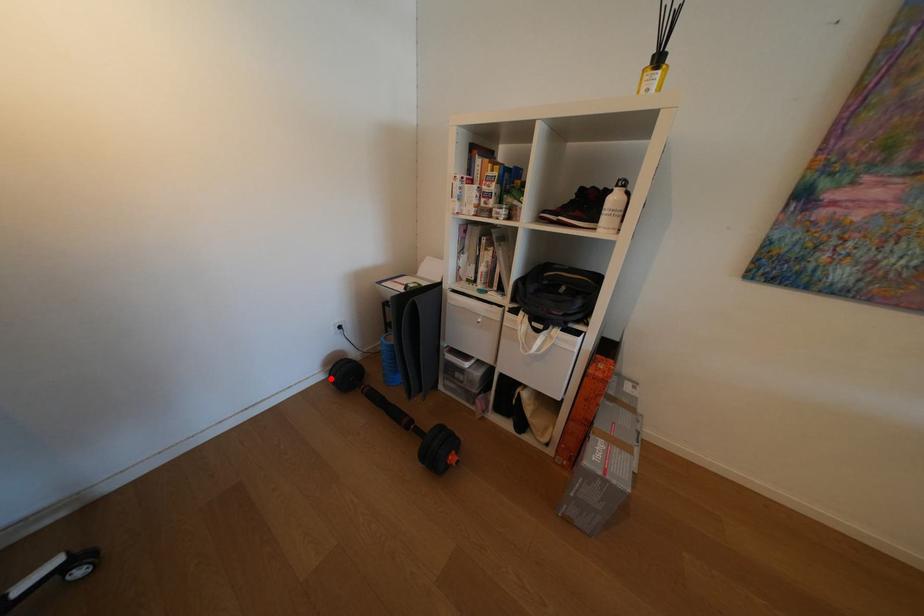
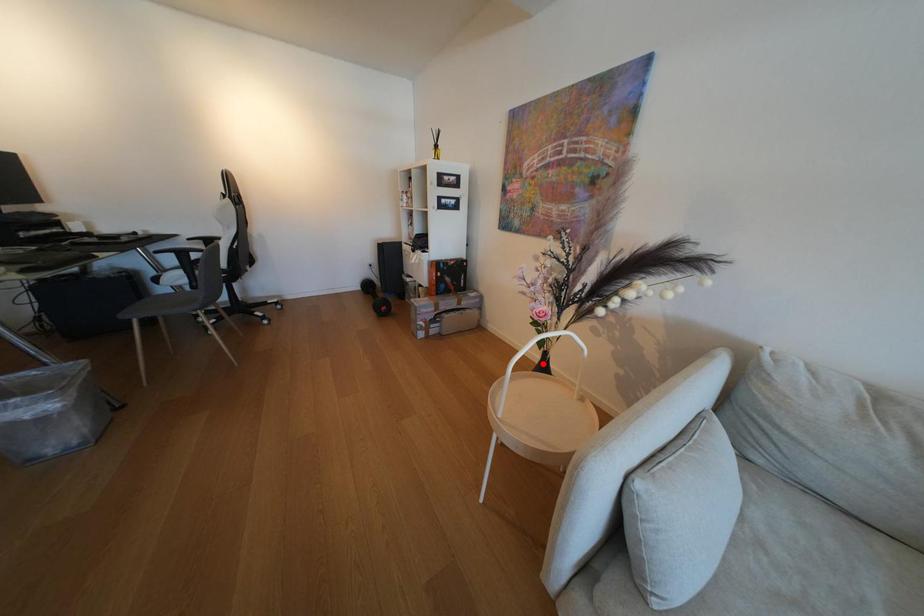
I am providing you with two images of the same scene from different viewpoints. A red point is marked on the first image and another point is marked on the second image. Does the point marked in image1 correspond to the same location as the one in image2?

No